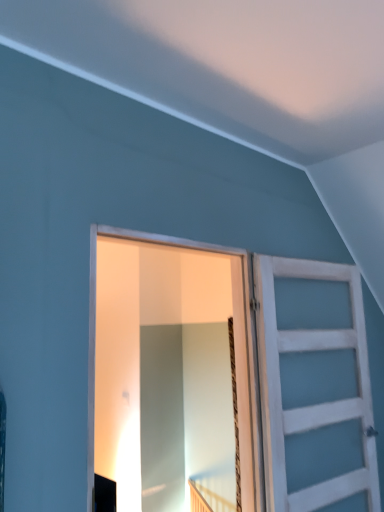
Question: Considering the relative positions of white wooden barn door at right, the 2th barn door positioned from the left, and white wooden barn door at center, the 1th barn door viewed from the left, in the image provided, is white wooden barn door at right, the 2th barn door positioned from the left, to the left or to the right of white wooden barn door at center, the 1th barn door viewed from the left,?

Choices:
 (A) left
 (B) right

Answer: (B)

Question: From the image's perspective, relative to white wooden barn door at center, the 1th barn door viewed from the left, is white wooden barn door at right, the 2th barn door positioned from the left, above or below?

Choices:
 (A) below
 (B) above

Answer: (A)

Question: Is point (276, 497) closer or farther from the camera than point (259, 471)?

Choices:
 (A) farther
 (B) closer

Answer: (B)

Question: From the image's perspective, is white wooden barn door at center, the 1th barn door viewed from the left, positioned above or below white wooden barn door at right, placed as the first barn door when sorted from right to left?

Choices:
 (A) above
 (B) below

Answer: (A)

Question: Considering their positions, is white wooden barn door at center, the 1th barn door viewed from the left, located in front of or behind white wooden barn door at right, placed as the first barn door when sorted from right to left?

Choices:
 (A) front
 (B) behind

Answer: (A)

Question: From a real-world perspective, is white wooden barn door at center, the 1th barn door viewed from the left, above or below white wooden barn door at right, placed as the first barn door when sorted from right to left?

Choices:
 (A) below
 (B) above

Answer: (B)

Question: In terms of width, does white wooden barn door at center, the 1th barn door viewed from the left, look wider or thinner when compared to white wooden barn door at right, placed as the first barn door when sorted from right to left?

Choices:
 (A) wide
 (B) thin

Answer: (B)